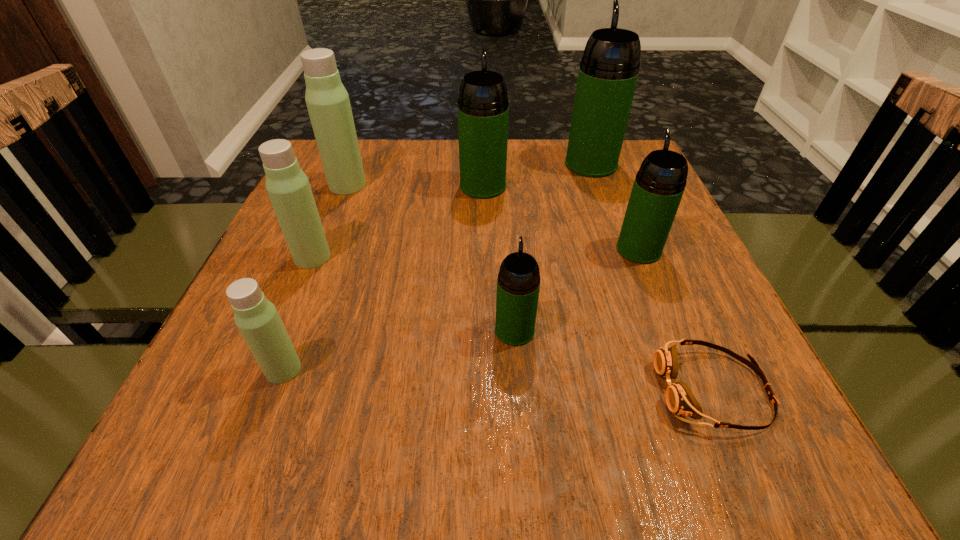
This screenshot has height=540, width=960. I want to click on goggles, so click(x=680, y=400).

I want to click on free space located 0.060m from the spout of the biggest green thermos bottle, so click(583, 141).

Locate an element on the screen. The image size is (960, 540). free space located 0.050m from the spout of the biggest green thermos bottle is located at coordinates (584, 143).

Find the location of a particular element. vacant area situated from the spout of the third smallest green thermos bottle is located at coordinates (483, 141).

Find the location of `vacant area situated 0.070m from the spout of the third smallest green thermos bottle`. vacant area situated 0.070m from the spout of the third smallest green thermos bottle is located at coordinates (483, 160).

Where is `vacant space located 0.150m from the spout of the third smallest green thermos bottle`? vacant space located 0.150m from the spout of the third smallest green thermos bottle is located at coordinates (483, 145).

Identify the location of vacant space located 0.210m on the right of the biggest light thermos bottle. (453, 185).

Locate an element on the screen. vacant space located 0.280m from the spout of the second smallest green thermos bottle is located at coordinates (606, 167).

Find the location of `vacant space situated 0.200m from the spout of the second smallest green thermos bottle`. vacant space situated 0.200m from the spout of the second smallest green thermos bottle is located at coordinates (612, 184).

The width and height of the screenshot is (960, 540). What are the coordinates of `vacant region located from the spout of the second smallest green thermos bottle` in the screenshot? It's located at (615, 191).